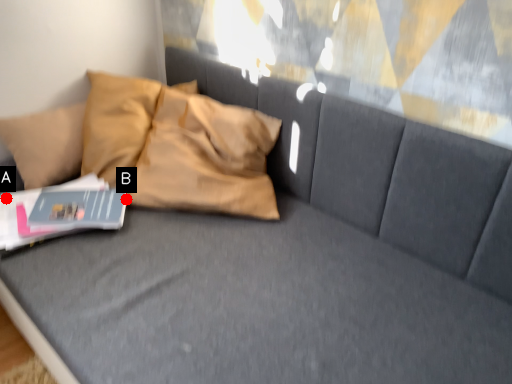
Question: Two points are circled on the image, labeled by A and B beside each circle. Which point is closer to the camera taking this photo?

Choices:
 (A) A is closer
 (B) B is closer

Answer: (A)